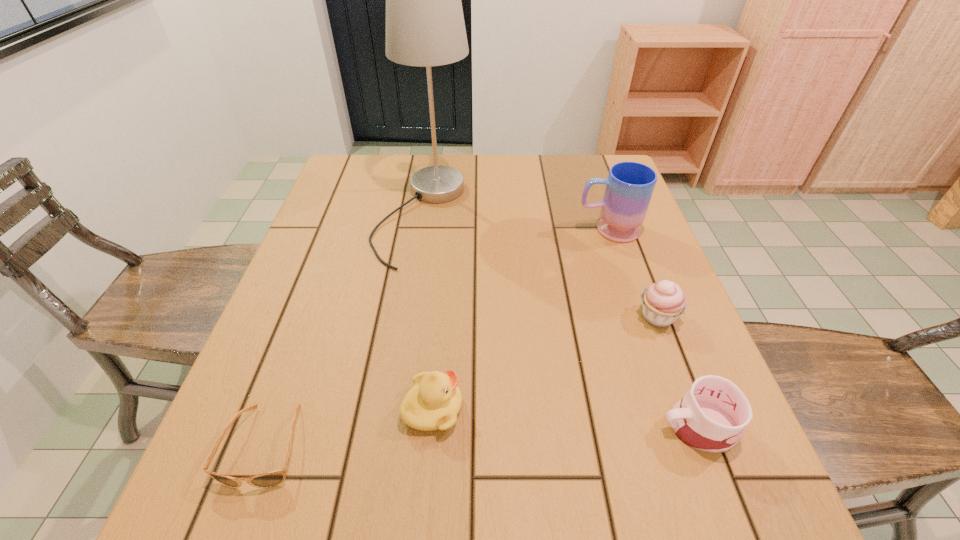
The image size is (960, 540). Find the location of `sunglasses that is positioned at the left edge`. sunglasses that is positioned at the left edge is located at coordinates (270, 479).

You are a GUI agent. You are given a task and a screenshot of the screen. Output one action in this format:
    pyautogui.click(x=<x>, y=<y>)
    Task: Click on the cupcake that is positioned at the right edge
    The image size is (960, 540).
    Given the screenshot: What is the action you would take?
    pyautogui.click(x=663, y=302)

You are a GUI agent. You are given a task and a screenshot of the screen. Output one action in this format:
    pyautogui.click(x=<x>, y=<y>)
    Task: Click on the object that is positioned at the far left corner
    This screenshot has height=540, width=960.
    Given the screenshot: What is the action you would take?
    pyautogui.click(x=425, y=27)

Where is `object positioned at the near left corner`? The width and height of the screenshot is (960, 540). object positioned at the near left corner is located at coordinates (270, 479).

Locate an element on the screen. The height and width of the screenshot is (540, 960). vacant area at the far edge is located at coordinates (444, 157).

Locate an element on the screen. The image size is (960, 540). vacant space at the left edge of the desktop is located at coordinates (319, 312).

Locate an element on the screen. The width and height of the screenshot is (960, 540). blank space at the right edge is located at coordinates (626, 343).

Find the location of a particular element. vacant point at the far left corner is located at coordinates (366, 181).

Find the location of a particular element. The height and width of the screenshot is (540, 960). free space between the table lamp and the leftmost object is located at coordinates click(x=345, y=330).

Locate an element on the screen. empty location between the tallest object and the farther mug is located at coordinates (516, 222).